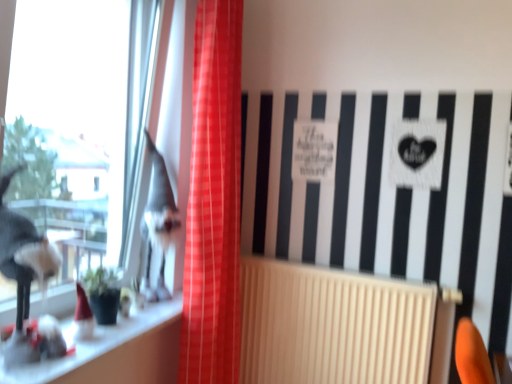
Question: Considering the relative sizes of beige ribbed radiator at center and white glossy window sill at lower left in the image provided, is beige ribbed radiator at center smaller than white glossy window sill at lower left?

Choices:
 (A) yes
 (B) no

Answer: (B)

Question: Is beige ribbed radiator at center aimed at white glossy window sill at lower left?

Choices:
 (A) no
 (B) yes

Answer: (B)

Question: Is beige ribbed radiator at center far away from white glossy window sill at lower left?

Choices:
 (A) yes
 (B) no

Answer: (B)

Question: From the image's perspective, is beige ribbed radiator at center below white glossy window sill at lower left?

Choices:
 (A) yes
 (B) no

Answer: (A)

Question: Is white glossy window sill at lower left completely or partially inside beige ribbed radiator at center?

Choices:
 (A) yes
 (B) no

Answer: (B)

Question: Is red plaid curtain at center situated inside shiny silver figurine at left or outside?

Choices:
 (A) inside
 (B) outside

Answer: (B)

Question: Considering the positions of red plaid curtain at center and shiny silver figurine at left in the image, is red plaid curtain at center taller or shorter than shiny silver figurine at left?

Choices:
 (A) tall
 (B) short

Answer: (A)

Question: Considering the positions of red plaid curtain at center and shiny silver figurine at left in the image, is red plaid curtain at center bigger or smaller than shiny silver figurine at left?

Choices:
 (A) big
 (B) small

Answer: (A)

Question: From a real-world perspective, is red plaid curtain at center above or below shiny silver figurine at left?

Choices:
 (A) below
 (B) above

Answer: (B)

Question: In terms of width, does shiny silver figurine at left look wider or thinner when compared to beige ribbed radiator at center?

Choices:
 (A) thin
 (B) wide

Answer: (B)

Question: Would you say shiny silver figurine at left is to the left or to the right of beige ribbed radiator at center in the picture?

Choices:
 (A) right
 (B) left

Answer: (B)

Question: Is shiny silver figurine at left inside the boundaries of beige ribbed radiator at center, or outside?

Choices:
 (A) inside
 (B) outside

Answer: (B)

Question: Relative to beige ribbed radiator at center, is shiny silver figurine at left in front or behind?

Choices:
 (A) behind
 (B) front

Answer: (A)

Question: Is point (151, 238) closer or farther from the camera than point (237, 215)?

Choices:
 (A) closer
 (B) farther

Answer: (A)

Question: Is shiny silver figurine at left inside or outside of red plaid curtain at center?

Choices:
 (A) inside
 (B) outside

Answer: (B)